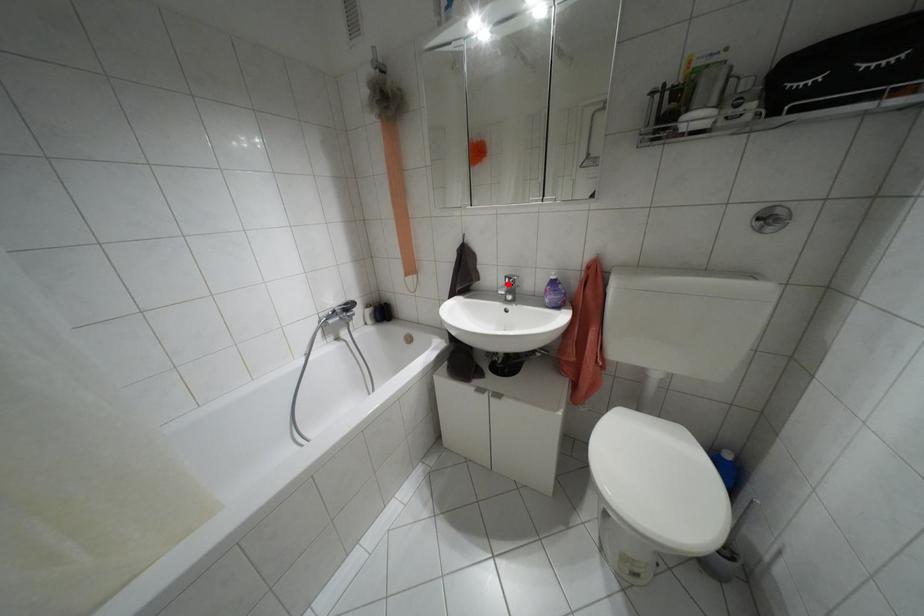
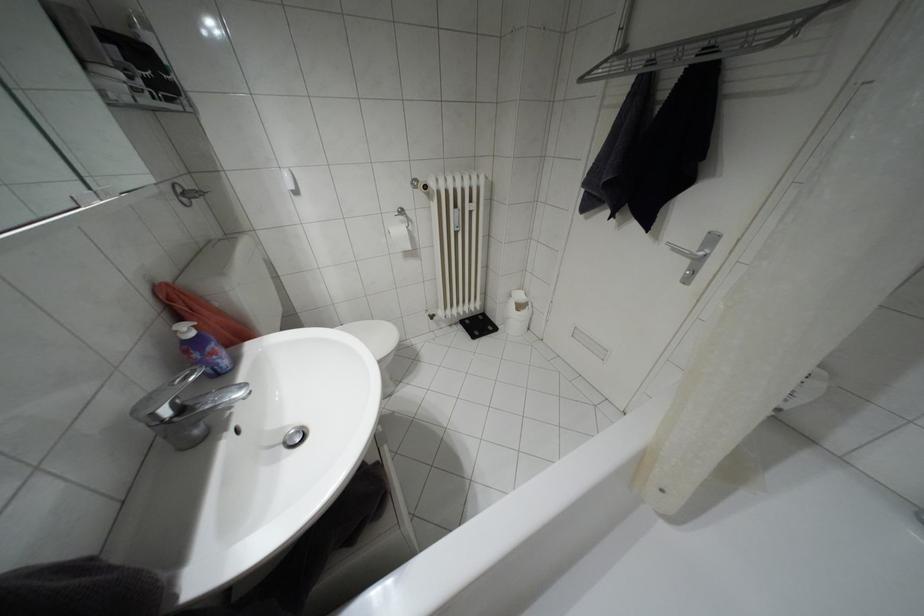
The point at the highlighted location is marked in the first image. Where is the corresponding point in the second image?

(180, 408)